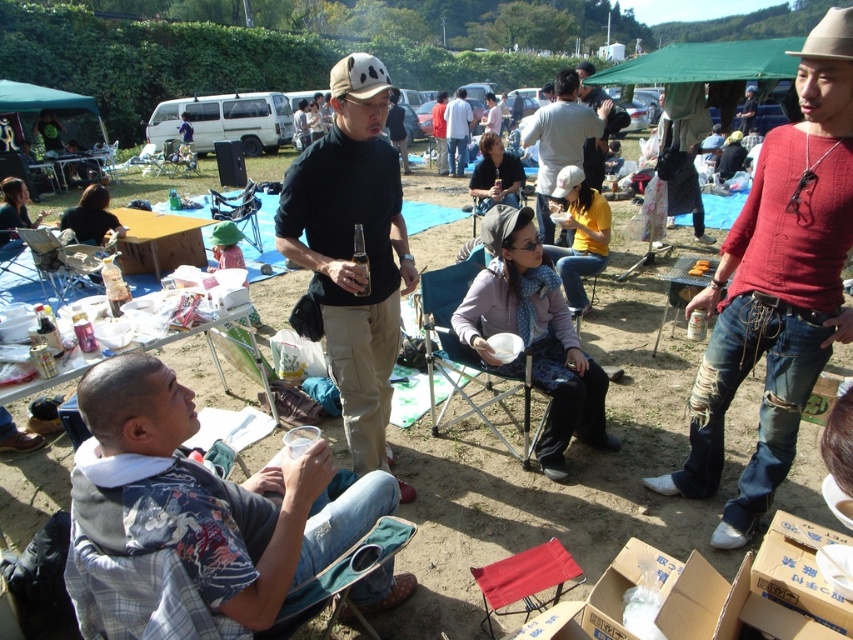
You are organizing a clothing donation drive and need to categorize shirts based on their size. You have two shirts in front of you labeled as matte black shirt at center and yellow cotton shirt at center. Which shirt should you place in the small size bin?

The matte black shirt at center has a smaller size compared to yellow cotton shirt at center, so it should be placed in the small size bin.